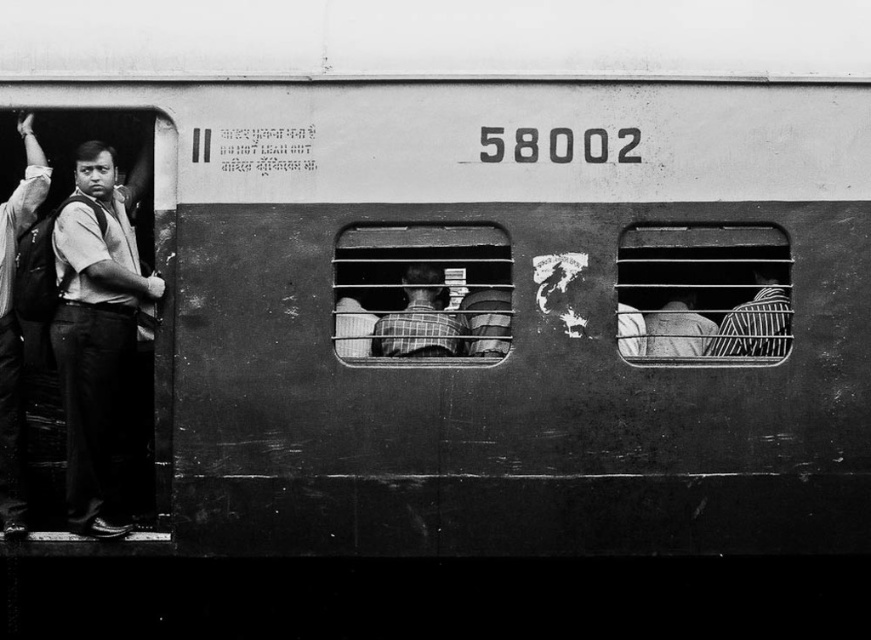
You are a passenger on the train car numbered 58002. You notice the metallic grid train window at center and the striped fabric shirt at right. Which object is taller?

The metallic grid train window at center is taller than the striped fabric shirt at right.

You are a photographer trying to capture the metallic grid at right and the matte black backpack at left in the same frame. Based on their heights, which object should you focus on first to ensure both are in the shot?

The metallic grid at right has a lesser height compared to the matte black backpack at left, so you should focus on the matte black backpack at left first to ensure both objects are captured in the frame.

You are a passenger on the train and want to place your matte black backpack at left on the seat next to the metallic grid at right. Can you do this without moving any other items?

The metallic grid at right is positioned on the right side of the matte black backpack at left, so placing the matte black backpack at left next to the metallic grid at right is possible without moving other items as they are already adjacent.